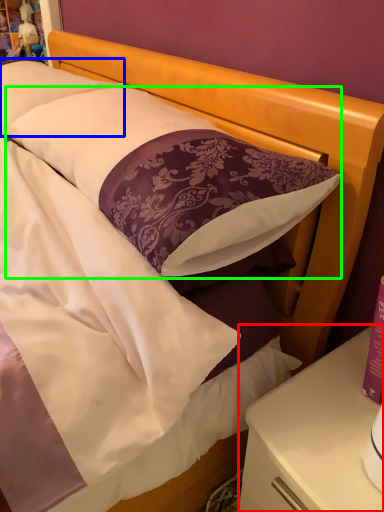
Question: Which object is positioned closest to nightstand (highlighted by a red box)? Select from pillow (highlighted by a blue box) and pillow (highlighted by a green box).

Choices:
 (A) pillow
 (B) pillow

Answer: (B)